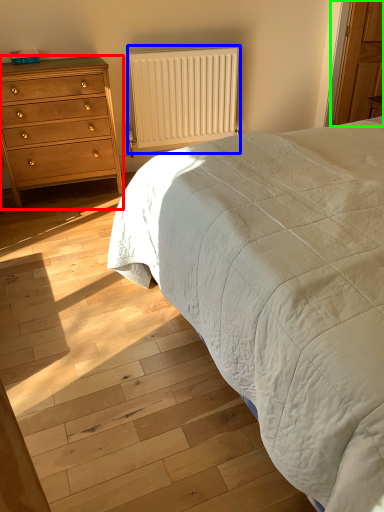
Question: Which is nearer to the chest of drawers (highlighted by a red box)? radiator (highlighted by a blue box) or armoire (highlighted by a green box).

Choices:
 (A) radiator
 (B) armoire

Answer: (A)